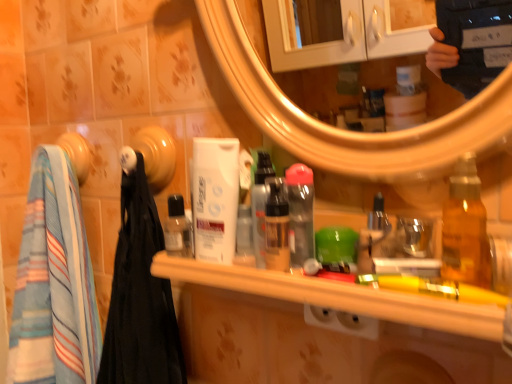
Question: Looking at their shapes, would you say white matte mouthwash at center, which is the third mouthwash in right-to-left order, is wider or thinner than translucent plastic spray bottle at center, the 1th bottle positioned from the left?

Choices:
 (A) thin
 (B) wide

Answer: (B)

Question: Relative to translucent plastic spray bottle at center, marked as the 1th bottle in a back-to-front arrangement, is white matte mouthwash at center, the 2th mouthwash in the left-to-right sequence, in front or behind?

Choices:
 (A) front
 (B) behind

Answer: (B)

Question: Which object is positioned closest to the transparent plastic bottle at center, which is the fourth mouthwash in right-to-left order?

Choices:
 (A) matte plastic mouthwash at center, which is counted as the 3th mouthwash, starting from the left
 (B) transparent plastic bottle at center, arranged as the fourth mouthwash when viewed from the left
 (C) white matte mouthwash at center, which is the third mouthwash in right-to-left order
 (D) striped cotton towel at left
 (E) translucent amber bottle at right, the 1th bottle positioned from the right

Answer: (C)

Question: Based on their relative distances, which object is farther from the matte plastic mouthwash at center, the 2th mouthwash when ordered from right to left?

Choices:
 (A) wooden shelf at center
 (B) striped cotton towel at left
 (C) transparent plastic bottle at center, arranged as the fourth mouthwash when viewed from the left
 (D) transparent plastic bottle at center, which is the first mouthwash in left-to-right order
 (E) translucent amber bottle at right, acting as the 1th bottle starting from the front

Answer: (B)